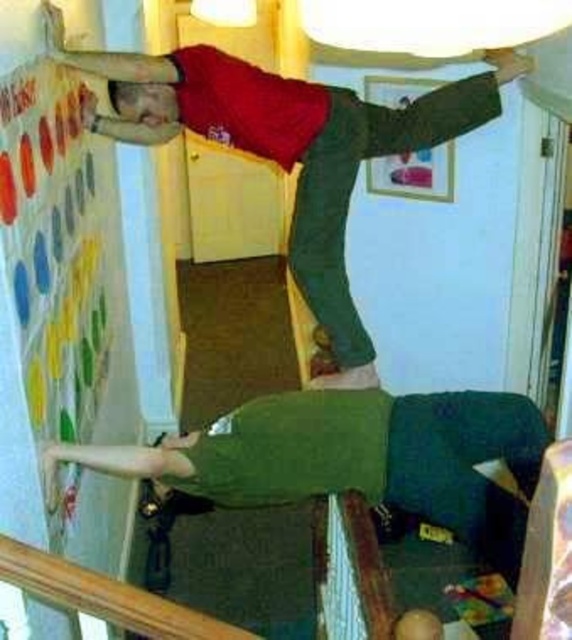
Can you confirm if green fabric couch at lower center is bigger than green matte pants at upper center?

No.

The width and height of the screenshot is (572, 640). Find the location of `green fabric couch at lower center`. green fabric couch at lower center is located at coordinates (359, 458).

Identify the location of green fabric couch at lower center. This screenshot has height=640, width=572. (359, 458).

Between multicolored fabric bulletin board at upper left and green matte pants at upper center, which one appears on the right side from the viewer's perspective?

Positioned to the right is green matte pants at upper center.

The width and height of the screenshot is (572, 640). Identify the location of multicolored fabric bulletin board at upper left. (63, 262).

Is point (62, 538) behind point (261, 145)?

No, it is in front of (261, 145).

Locate an element on the screen. multicolored fabric bulletin board at upper left is located at coordinates (63, 262).

Who is shorter, multicolored fabric bulletin board at upper left or green fabric couch at lower center?

green fabric couch at lower center

Does point (82, 152) lie behind point (487, 557)?

Yes, point (82, 152) is behind point (487, 557).

Measure the distance between multicolored fabric bulletin board at upper left and camera.

They are 1.70 meters apart.

This screenshot has width=572, height=640. I want to click on multicolored fabric bulletin board at upper left, so click(x=63, y=262).